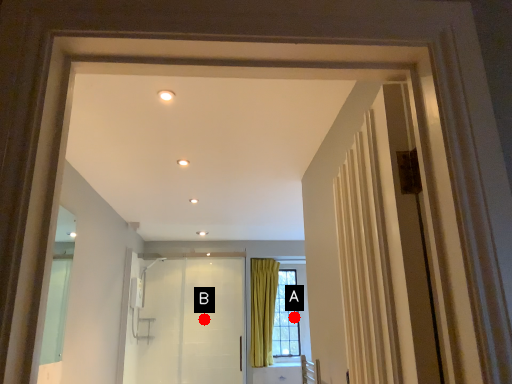
Question: Two points are circled on the image, labeled by A and B beside each circle. Among these points, which one is nearest to the camera?

Choices:
 (A) A is closer
 (B) B is closer

Answer: (B)